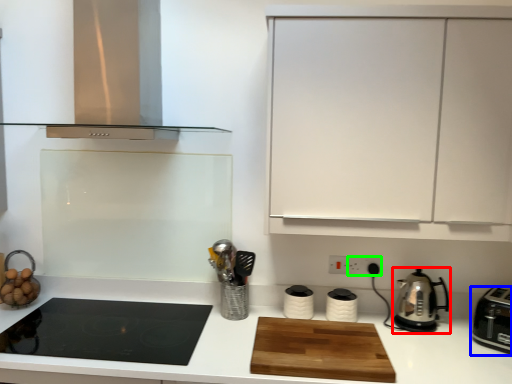
Question: Based on their relative distances, which object is nearer to kitchen appliance (highlighted by a red box)? Choose from kitchen appliance (highlighted by a blue box) and electric outlet (highlighted by a green box).

Choices:
 (A) kitchen appliance
 (B) electric outlet

Answer: (A)